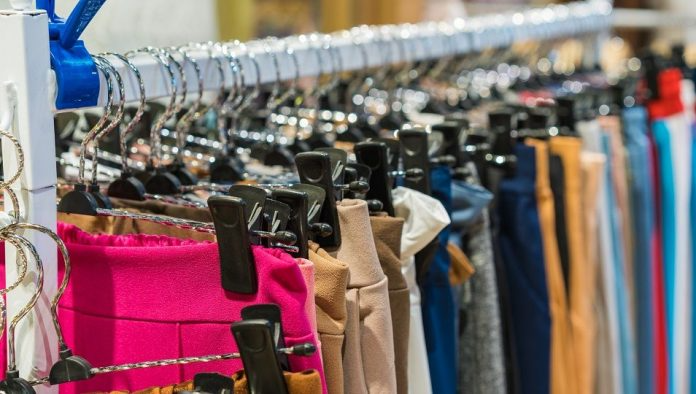
Locate an element on the screen. clothes wrack is located at coordinates (29, 80).